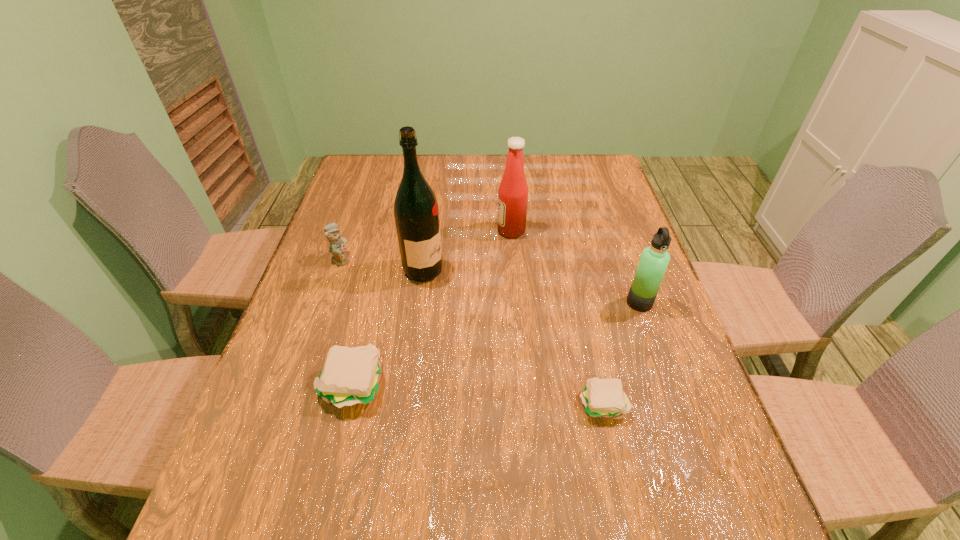
The height and width of the screenshot is (540, 960). I want to click on the taller patty, so click(353, 375).

I want to click on the fifth tallest object, so click(353, 375).

Locate an element on the screen. The width and height of the screenshot is (960, 540). the shortest object is located at coordinates (604, 398).

This screenshot has height=540, width=960. I want to click on the fifth object from left to right, so click(x=604, y=398).

Where is `the fourth object from left to right`? the fourth object from left to right is located at coordinates (513, 191).

The image size is (960, 540). What are the coordinates of `the fifth shortest object` in the screenshot? It's located at (513, 191).

What are the coordinates of `the leftmost object` in the screenshot? It's located at (337, 247).

Find the location of `the fourth tallest object`. the fourth tallest object is located at coordinates [x=337, y=247].

Identify the location of the tallest object. Image resolution: width=960 pixels, height=540 pixels. (416, 212).

This screenshot has width=960, height=540. Find the location of `the fourth farthest object`. the fourth farthest object is located at coordinates (654, 260).